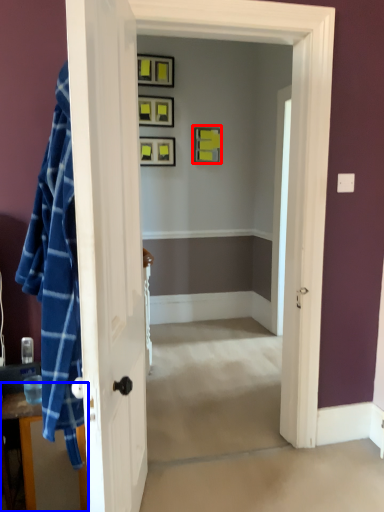
Question: Among these objects, which one is nearest to the camera, picture frame (highlighted by a red box) or dresser (highlighted by a blue box)?

Choices:
 (A) picture frame
 (B) dresser

Answer: (B)